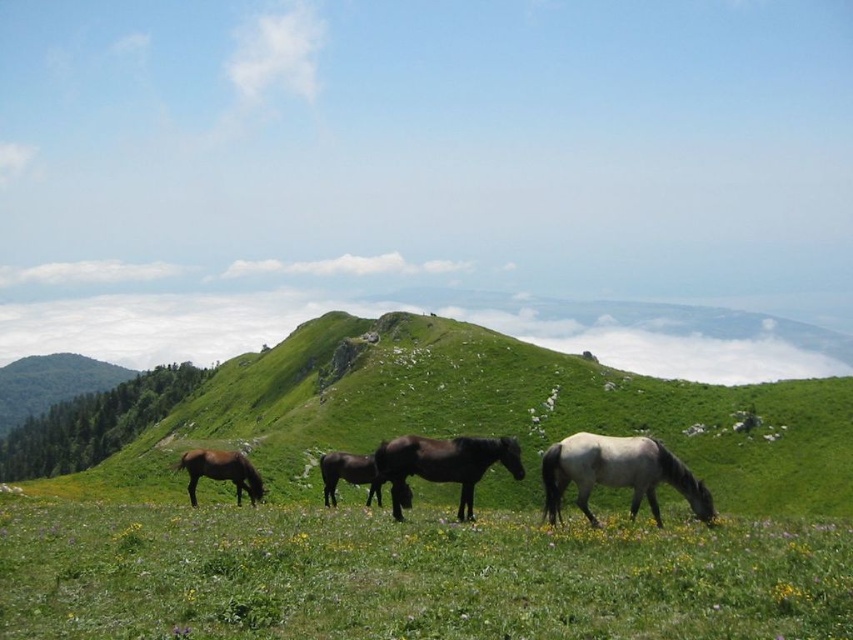
You are standing at the origin point in the meadow and see two points marked on the ground. One is labeled as point [759,492] and the other as point [585,496]. Which point is farther away from you?

Point [759,492] is farther away from you because it is behind point [585,496].

You are standing in the meadow and want to climb the green grassy hillside at center. Based on the coordinates provided, which direction should you walk to reach it?

The green grassy hillside at center is located at coordinates point (483, 413), so you should walk towards the center of the image to reach it.

You are standing in the meadow and want to walk towards the green grassy hillside at center. Which direction should you head relative to the brown glossy horse at lower left?

You should head away from the brown glossy horse at lower left because the green grassy hillside at center is further away from you, meaning it is located behind the horse.